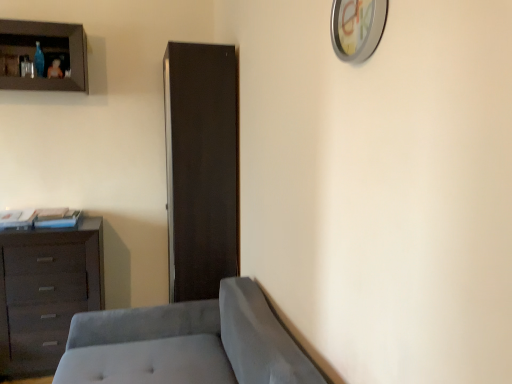
Question: Would you say matte brown cabinet at upper left is to the left or to the right of dark brown wooden chest of drawers at left in the picture?

Choices:
 (A) left
 (B) right

Answer: (A)

Question: Considering the positions of matte brown cabinet at upper left and dark brown wooden chest of drawers at left in the image, is matte brown cabinet at upper left wider or thinner than dark brown wooden chest of drawers at left?

Choices:
 (A) wide
 (B) thin

Answer: (B)

Question: Estimate the real-world distances between objects in this image. Which object is farther from the matte black cabinet at center?

Choices:
 (A) dark brown wooden chest of drawers at left
 (B) suede gray studio couch at lower left
 (C) matte brown cabinet at upper left
 (D) metallic clock at upper right

Answer: (D)

Question: Which is farther from the suede gray studio couch at lower left?

Choices:
 (A) matte brown cabinet at upper left
 (B) dark brown wooden chest of drawers at left
 (C) matte black cabinet at center
 (D) metallic clock at upper right

Answer: (A)